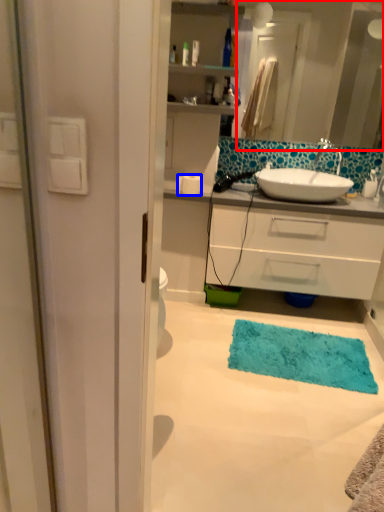
Question: Among these objects, which one is nearest to the camera, mirror (highlighted by a red box) or toilet paper (highlighted by a blue box)?

Choices:
 (A) mirror
 (B) toilet paper

Answer: (A)